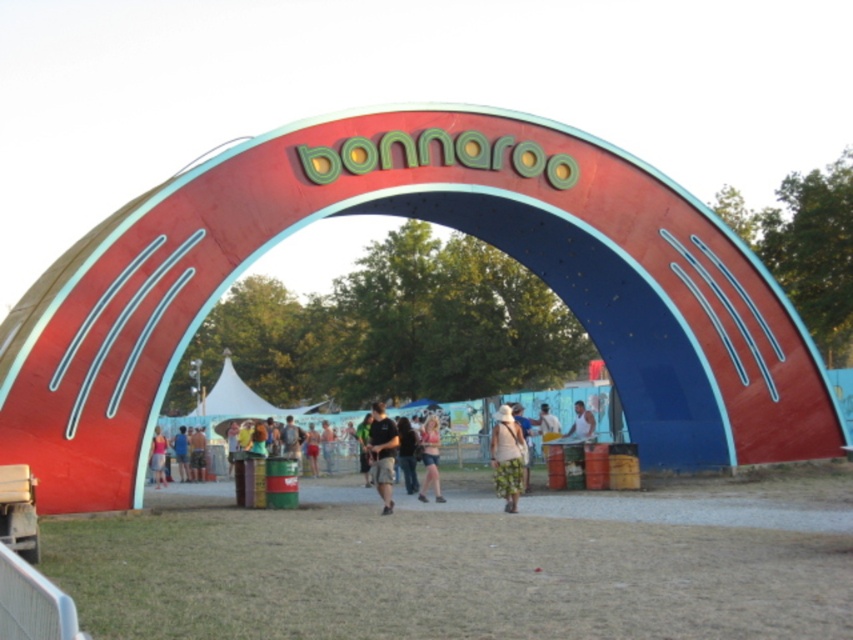
Does matte pink shorts at center appear on the right side of blue denim shorts at center?

Yes, matte pink shorts at center is to the right of blue denim shorts at center.

Who is positioned more to the right, matte pink shorts at center or blue denim shorts at center?

matte pink shorts at center

What do you see at coordinates (430, 458) in the screenshot?
I see `matte pink shorts at center` at bounding box center [430, 458].

I want to click on matte pink shorts at center, so click(x=430, y=458).

Which is in front, point (434, 440) or point (158, 436)?

Point (434, 440) is more forward.

You are a GUI agent. You are given a task and a screenshot of the screen. Output one action in this format:
    pyautogui.click(x=<x>, y=<y>)
    Task: Click on the matte pink shorts at center
    This screenshot has height=640, width=853.
    Given the screenshot: What is the action you would take?
    pyautogui.click(x=430, y=458)

Who is more distant from viewer, (422, 444) or (161, 472)?

Point (161, 472)

Identify the location of matte pink shorts at center. (430, 458).

Which is behind, point (381, 432) or point (428, 458)?

The point (428, 458) is behind.

Which is more to the right, black cotton shirt at center or matte pink shorts at center?

Positioned to the right is matte pink shorts at center.

Between point (378, 426) and point (437, 458), which one is positioned in front?

Point (378, 426) is in front.

Locate an element on the screen. black cotton shirt at center is located at coordinates tap(381, 452).